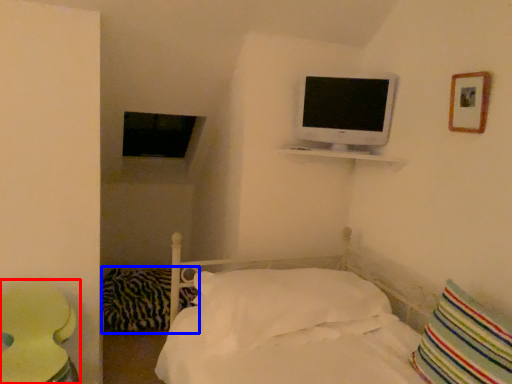
Question: Which point is further to the camera, round table (highlighted by a red box) or pillow (highlighted by a blue box)?

Choices:
 (A) round table
 (B) pillow

Answer: (B)